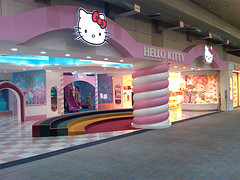
In order to click on store shelves in this screenshot , I will do `click(118, 95)`.